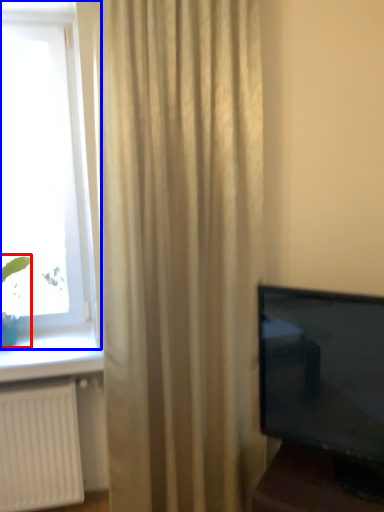
Question: Which object is closer to the camera taking this photo, plant (highlighted by a red box) or window (highlighted by a blue box)?

Choices:
 (A) plant
 (B) window

Answer: (B)